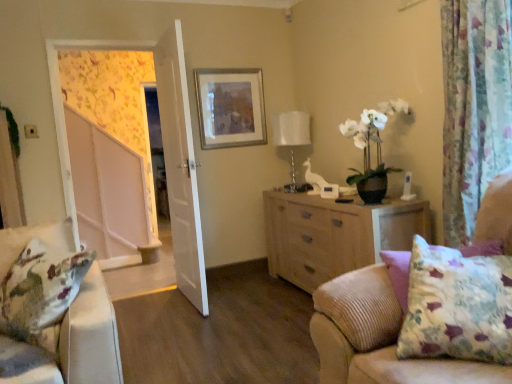
Locate an element on the screen. This screenshot has height=384, width=512. vacant area on top of white glossy screen door at left (from a real-world perspective) is located at coordinates pos(108,32).